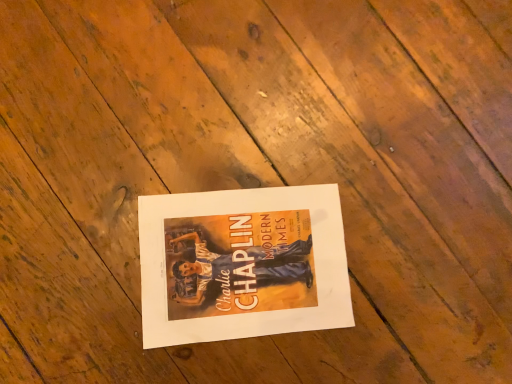
Where is `free space behind matte paper poster at center`? The width and height of the screenshot is (512, 384). free space behind matte paper poster at center is located at coordinates (317, 135).